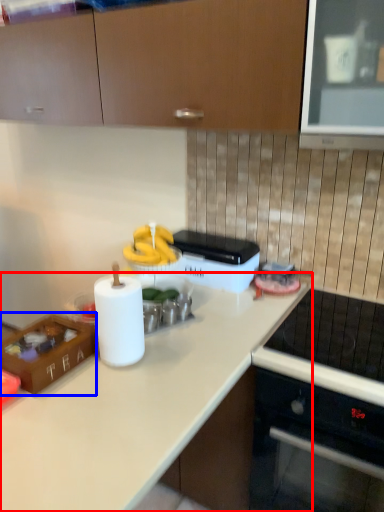
Question: Which object appears farthest to the camera in this image, countertop (highlighted by a red box) or kitchen appliance (highlighted by a blue box)?

Choices:
 (A) countertop
 (B) kitchen appliance

Answer: (B)